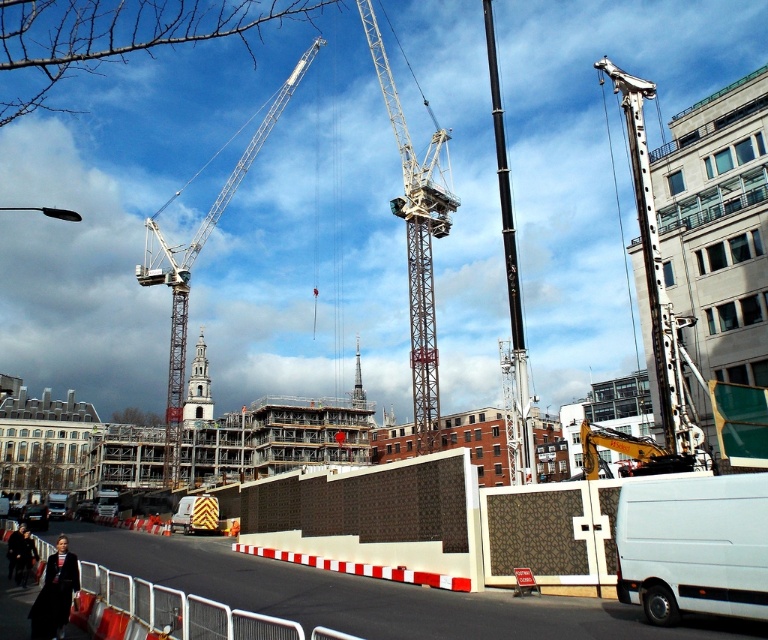
Consider the image. Does metallic gray crane at center appear over dark brown leather jacket at lower left?

Indeed, metallic gray crane at center is positioned over dark brown leather jacket at lower left.

Consider the image. Is metallic gray crane at center smaller than dark brown leather jacket at lower left?

No.

At what (x,y) coordinates should I click in order to perform the action: click on metallic gray crane at center. Please return your answer as a coordinate pair (x, y). The image size is (768, 640). Looking at the image, I should click on (416, 237).

From the picture: Which of these two, white matte van at lower right or white metallic crane at upper left, stands shorter?

white matte van at lower right

Can you confirm if white matte van at lower right is positioned below white metallic crane at upper left?

Yes, white matte van at lower right is below white metallic crane at upper left.

At what (x,y) coordinates should I click in order to perform the action: click on white matte van at lower right. Please return your answer as a coordinate pair (x, y). The height and width of the screenshot is (640, 768). Looking at the image, I should click on [694, 547].

Consider the image. Can you confirm if metallic gray crane at center is positioned below metallic gray crane at right?

Actually, metallic gray crane at center is above metallic gray crane at right.

Can you confirm if metallic gray crane at center is positioned to the right of metallic gray crane at right?

No, metallic gray crane at center is not to the right of metallic gray crane at right.

Does point (425, 380) come closer to viewer compared to point (660, 412)?

No, (425, 380) is further to viewer.

This screenshot has width=768, height=640. In order to click on metallic gray crane at center in this screenshot , I will do `click(416, 237)`.